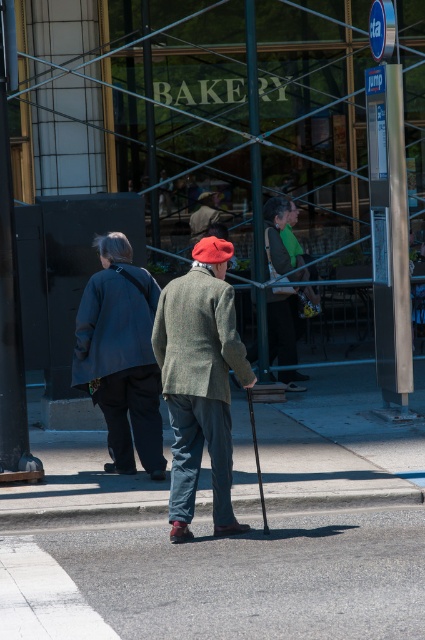
Question: Among these objects, which one is nearest to the camera?

Choices:
 (A) matte gray jacket at center
 (B) dark gray wool coat at center
 (C) gray asphalt at center

Answer: (C)

Question: Which of these objects is positioned farthest from the matte green sweater at center?

Choices:
 (A) green tweed jacket at center
 (B) dark gray wool coat at center

Answer: (A)

Question: Can you confirm if gray asphalt at center is positioned to the right of green tweed jacket at center?

Choices:
 (A) no
 (B) yes

Answer: (B)

Question: Is the position of green tweed jacket at center less distant than that of matte gray jacket at center?

Choices:
 (A) no
 (B) yes

Answer: (B)

Question: Which object appears farthest from the camera in this image?

Choices:
 (A) green tweed jacket at center
 (B) matte green sweater at center

Answer: (B)

Question: Considering the relative positions of gray asphalt at center and matte gray jacket at center in the image provided, where is gray asphalt at center located with respect to matte gray jacket at center?

Choices:
 (A) below
 (B) above

Answer: (A)